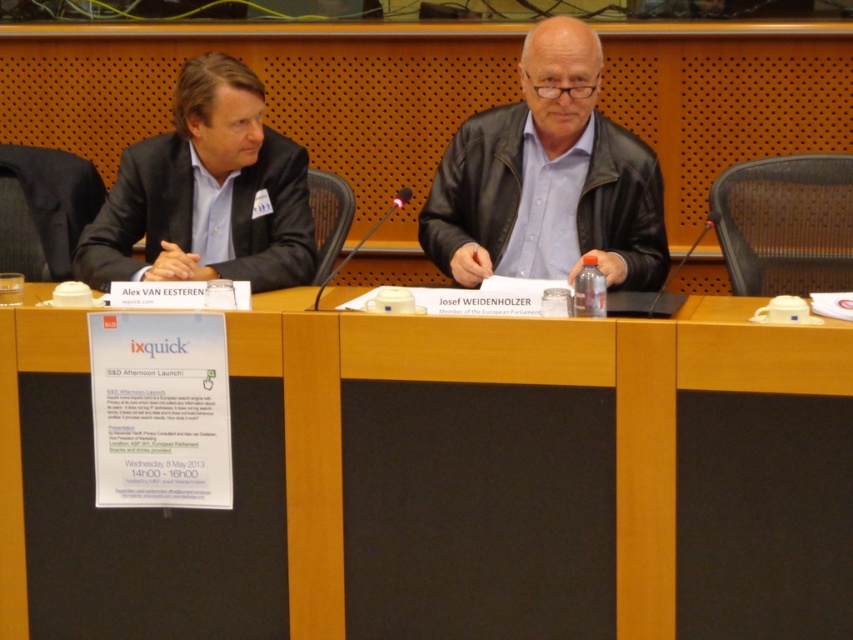
What is the coordinate of the wooden at center?

The wooden at center is located at coordinate point [451,481].

You are a photographer setting up for a formal event. You need to position a spotlight so it can illuminate both the wooden at center and the matte black suit at left. Given their height difference, which object should you adjust the spotlight height to accommodate first?

The wooden at center is much taller than the matte black suit at left, so you should adjust the spotlight height to accommodate the wooden at center first to ensure proper illumination for both.

From the picture: You are standing 10 feet away from the conference table. Is the point at coordinates point (270, 336) closer to you than the table?

The distance of point (270, 336) from viewer is 9.12 feet, which is less than 10 feet, so yes, the point at coordinates point (270, 336) is closer to you than the table.